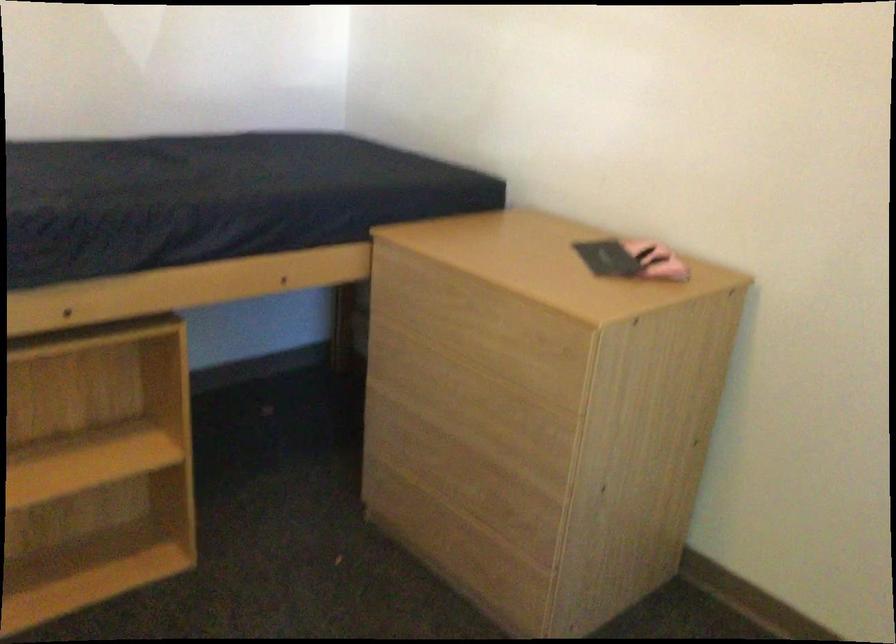
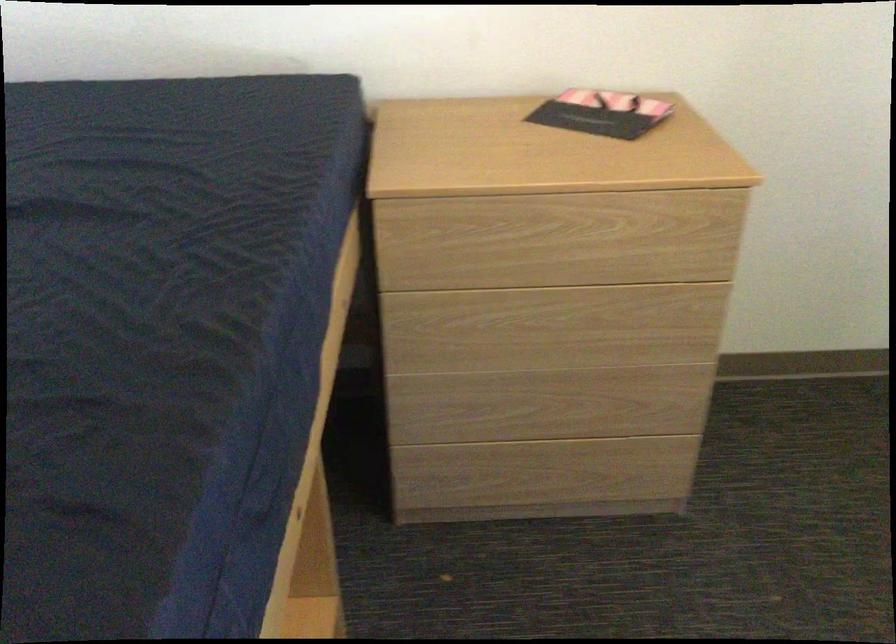
Where in the second image is the point corresponding to (428,420) from the first image?

(518, 368)